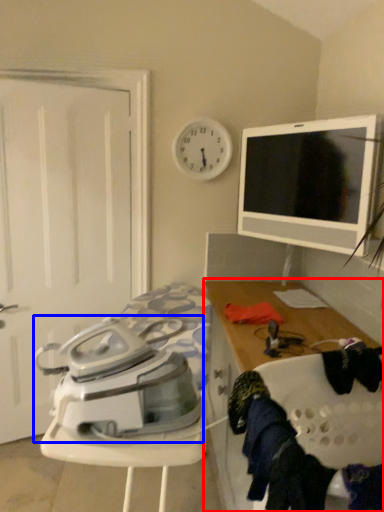
Question: Which of the following is the farthest to the observer, cabinetry (highlighted by a red box) or home appliance (highlighted by a blue box)?

Choices:
 (A) cabinetry
 (B) home appliance

Answer: (B)